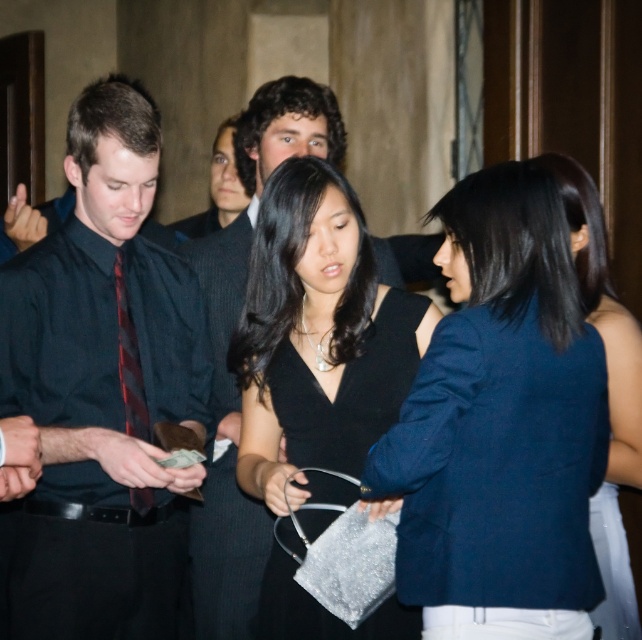
In the scene shown: Is dark blue shirt at center to the left of black silk tie at left from the viewer's perspective?

Indeed, dark blue shirt at center is positioned on the left side of black silk tie at left.

Is point (30, 298) positioned after point (117, 257)?

No, (30, 298) is in front of (117, 257).

The width and height of the screenshot is (642, 640). What do you see at coordinates (103, 387) in the screenshot? I see `dark blue shirt at center` at bounding box center [103, 387].

Identify the location of dark blue shirt at center. This screenshot has height=640, width=642. (103, 387).

Does black satin dress at center have a smaller size compared to black silk tie at left?

Actually, black satin dress at center might be larger than black silk tie at left.

Does black satin dress at center appear under black silk tie at left?

Correct, black satin dress at center is located below black silk tie at left.

Who is more distant from viewer, [266,595] or [126,387]?

Positioned behind is point [126,387].

At what (x,y) coordinates should I click in order to perform the action: click on black satin dress at center. Please return your answer as a coordinate pair (x, y). Looking at the image, I should click on (349, 388).

Who is lower down, dark blue shirt at center or black satin dress at center?

Positioned lower is black satin dress at center.

Does dark blue shirt at center have a lesser width compared to black satin dress at center?

No.

You are a GUI agent. You are given a task and a screenshot of the screen. Output one action in this format:
    pyautogui.click(x=<x>, y=<y>)
    Task: Click on the dark blue shirt at center
    
    Given the screenshot: What is the action you would take?
    pyautogui.click(x=103, y=387)

Locate an element on the screen. This screenshot has width=642, height=640. dark blue shirt at center is located at coordinates (103, 387).